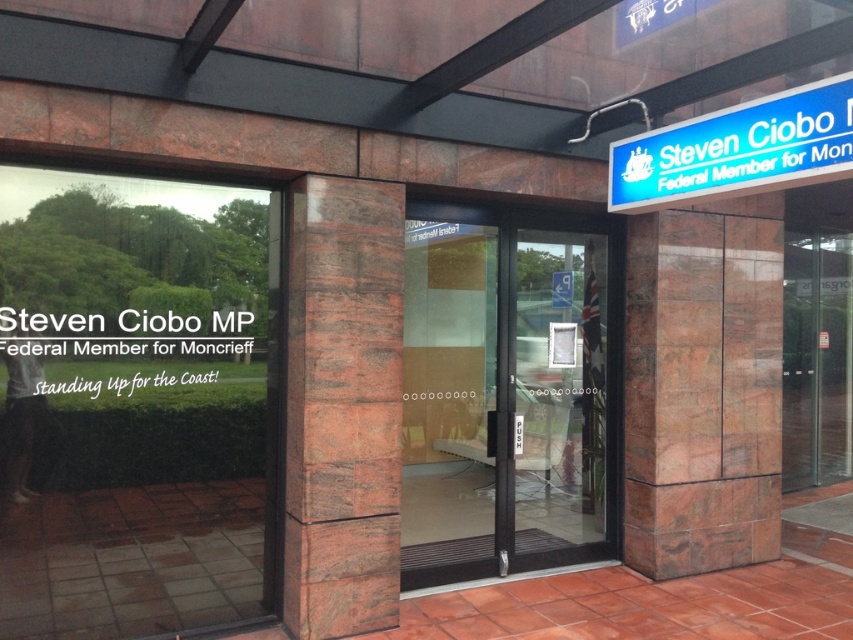
Question: Which of the following is the closest to the observer?

Choices:
 (A) (614, 188)
 (B) (567, 228)

Answer: (A)

Question: Is black glass door at center bigger than blue plastic sign at upper right?

Choices:
 (A) yes
 (B) no

Answer: (A)

Question: Does black glass door at center have a greater width compared to blue plastic sign at upper right?

Choices:
 (A) no
 (B) yes

Answer: (B)

Question: Is black glass door at center below blue plastic sign at upper right?

Choices:
 (A) yes
 (B) no

Answer: (A)

Question: Among these points, which one is farthest from the camera?

Choices:
 (A) pyautogui.click(x=473, y=365)
 (B) pyautogui.click(x=766, y=124)

Answer: (A)